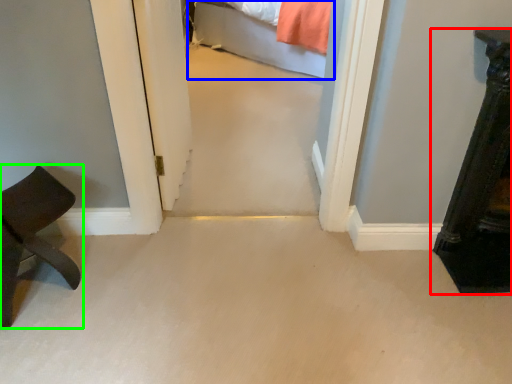
Question: Based on their relative distances, which object is nearer to furniture (highlighted by a red box)? Choose from bed (highlighted by a blue box) and furniture (highlighted by a green box).

Choices:
 (A) bed
 (B) furniture

Answer: (B)